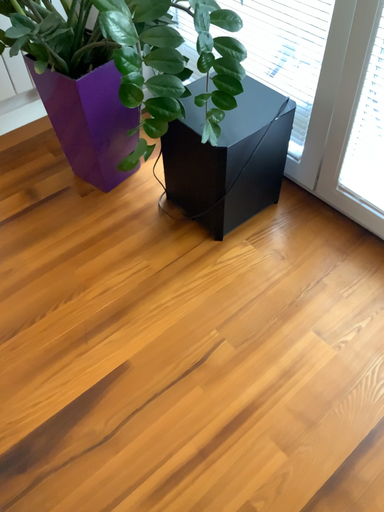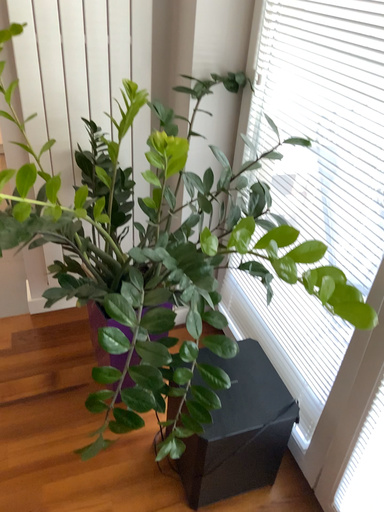
Question: Which way did the camera rotate in the video?

Choices:
 (A) rotated left
 (B) rotated right

Answer: (A)